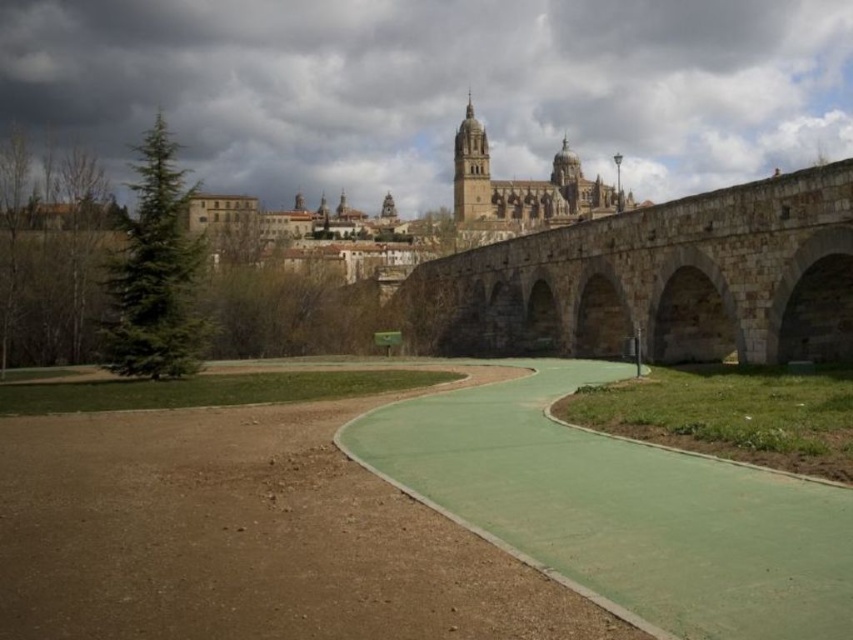
You are a city planner analyzing the image. The city wants to install a new bike lane on the bridge that accommodates two bicycles side by side. Which bridge, the matte stone bridge at center or the stone arch bridge at center, is more suitable for this purpose based on their widths?

The matte stone bridge at center is more suitable for the bike lane since its width surpasses that of the stone arch bridge at center, providing enough space for two bicycles side by side.

You are a tourist standing at the entrance of the pathway and want to reach the stone arch bridge at center. Which direction should you walk to get there from the green concrete path at center?

The green concrete path at center is in front of the stone arch bridge at center, so you should walk forward along the green concrete path at center towards the bridge.

You are a tourist standing in front of the matte stone bridge at center and the stone arch bridge at center. Which bridge is closer to you?

The matte stone bridge at center is closer to you because it is positioned further to the viewer than the stone arch bridge at center.